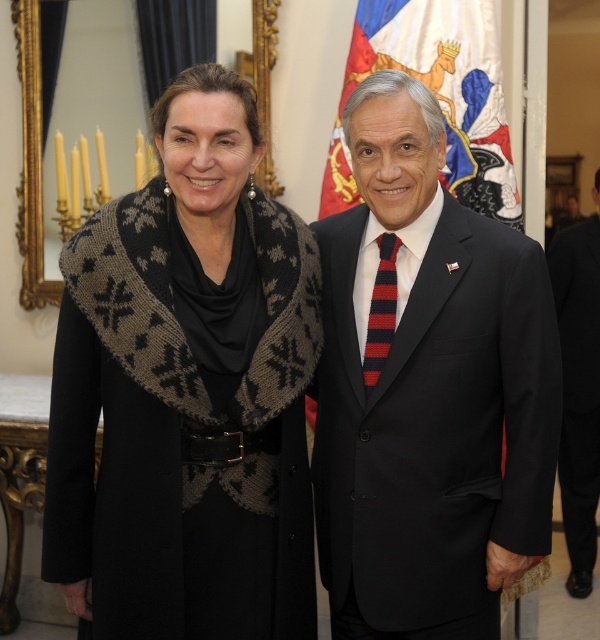
Consider the image. You are a photographer adjusting your camera settings to focus on two points in the image. The first point is at coordinates point (586, 532) and the second is at point (379, 282). Which point should you focus on first if you want to ensure the closest object is in focus?

Point (586, 532) is further to the camera than point (379, 282), so you should focus on point (586, 532) first to capture the closest object in focus.